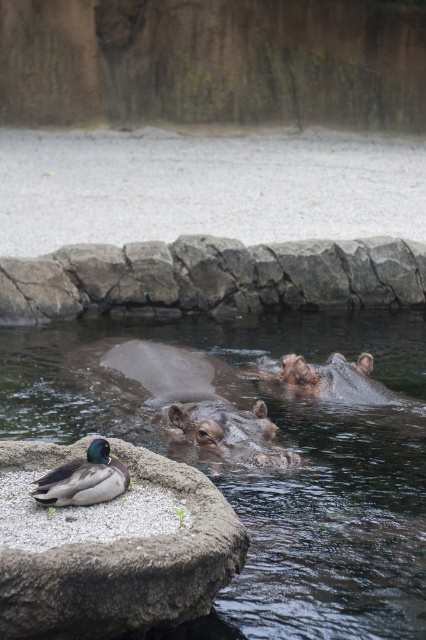
Question: Is gray rough stone at lower left closer to camera compared to green glossy duck at lower left?

Choices:
 (A) yes
 (B) no

Answer: (A)

Question: Does clear water at hippo center appear under gray rough stone at lower left?

Choices:
 (A) yes
 (B) no

Answer: (B)

Question: Which point appears farthest from the camera in this image?

Choices:
 (A) (43, 566)
 (B) (45, 499)

Answer: (B)

Question: Among these points, which one is nearest to the camera?

Choices:
 (A) (88, 502)
 (B) (34, 464)

Answer: (A)

Question: Among these points, which one is farthest from the camera?

Choices:
 (A) (92, 440)
 (B) (178, 547)
 (C) (287, 564)

Answer: (C)

Question: Can you confirm if clear water at hippo center is smaller than gray rough stone at lower left?

Choices:
 (A) no
 (B) yes

Answer: (A)